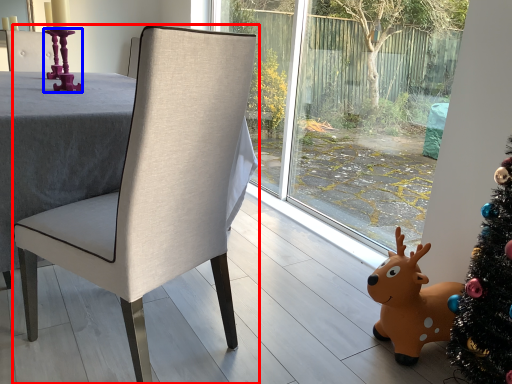
Question: Which of the following is the closest to the observer, chair (highlighted by a red box) or candle holder (highlighted by a blue box)?

Choices:
 (A) chair
 (B) candle holder

Answer: (A)